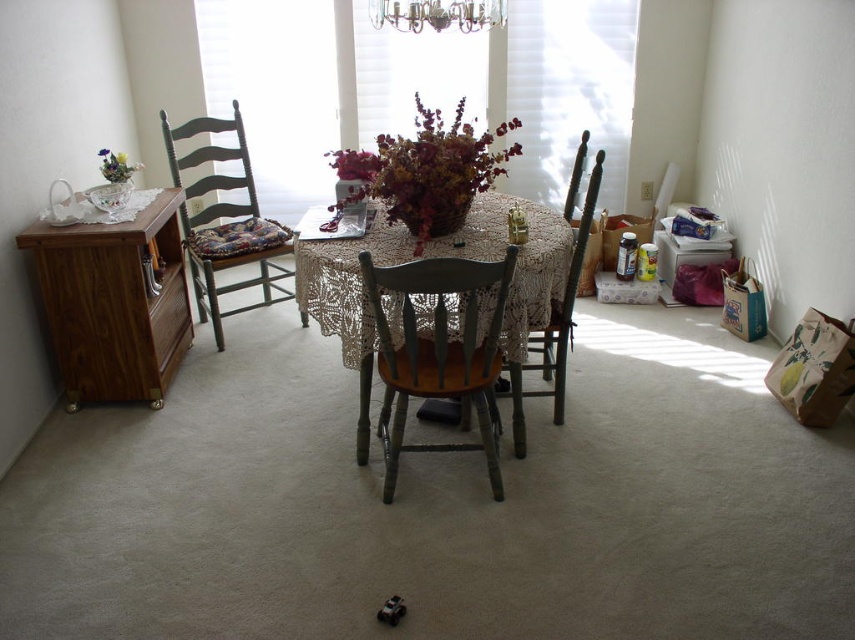
Who is positioned more to the right, translucent glass window at center or matte floral arrangement at left?

translucent glass window at center is more to the right.

Between translucent glass window at center and matte floral arrangement at left, which one appears on the left side from the viewer's perspective?

matte floral arrangement at left is more to the left.

Is point (600, 36) farther from camera compared to point (113, 170)?

Yes.

Locate an element on the screen. The width and height of the screenshot is (855, 640). translucent glass window at center is located at coordinates (275, 92).

Who is more distant from viewer, (541,244) or (386,3)?

The point (386,3) is behind.

Can you confirm if lace fabric tablecloth at center is positioned below metallic chandelier at upper center?

Yes.

Does point (358, 240) lie in front of point (470, 12)?

Yes, point (358, 240) is in front of point (470, 12).

You are a GUI agent. You are given a task and a screenshot of the screen. Output one action in this format:
    pyautogui.click(x=<x>, y=<y>)
    Task: Click on the lace fabric tablecloth at center
    
    Given the screenshot: What is the action you would take?
    pyautogui.click(x=516, y=260)

Based on the photo, can you confirm if dark brown wood chair at center is positioned below metallic chandelier at upper center?

Yes.

Can you confirm if dark brown wood chair at center is positioned to the left of metallic chandelier at upper center?

Correct, you'll find dark brown wood chair at center to the left of metallic chandelier at upper center.

Measure the distance between dark brown wood chair at center and camera.

dark brown wood chair at center is 1.83 meters from camera.

Identify the location of dark brown wood chair at center. (438, 352).